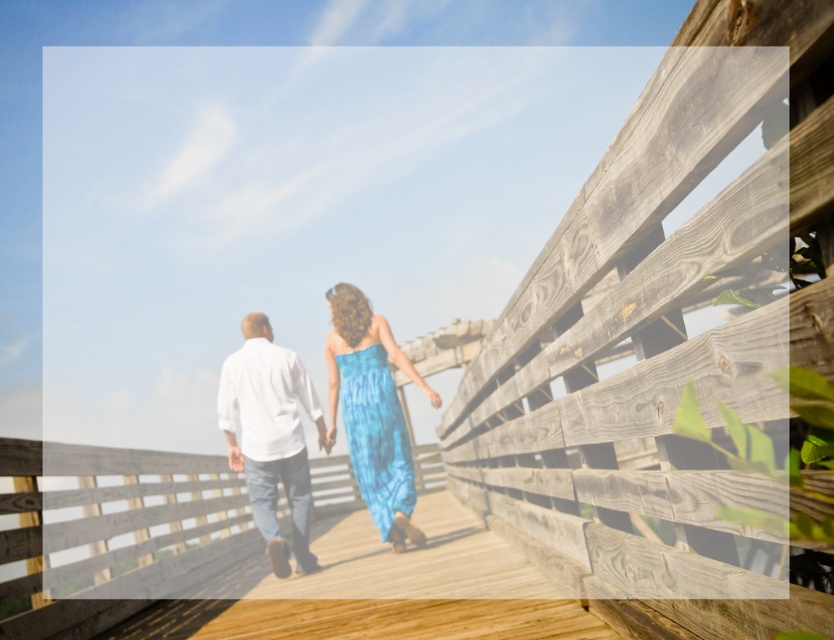
Based on the photo, is blue silk dress at center above white cotton shirt at center?

Indeed, blue silk dress at center is positioned over white cotton shirt at center.

You are a GUI agent. You are given a task and a screenshot of the screen. Output one action in this format:
    pyautogui.click(x=<x>, y=<y>)
    Task: Click on the blue silk dress at center
    Image resolution: width=834 pixels, height=640 pixels.
    Given the screenshot: What is the action you would take?
    point(370,412)

Who is higher up, white cotton shirt at center or blue tie-dye dress at center?

blue tie-dye dress at center

Is white cotton shirt at center wider than blue tie-dye dress at center?

No.

This screenshot has height=640, width=834. In order to click on white cotton shirt at center in this screenshot , I will do `click(270, 435)`.

How far apart are blue silk dress at center and blue tie-dye dress at center?

blue silk dress at center and blue tie-dye dress at center are 2.11 centimeters apart.

Which is behind, point (392, 541) or point (339, 320)?

The point (392, 541) is behind.

The image size is (834, 640). In order to click on blue silk dress at center in this screenshot , I will do `click(370, 412)`.